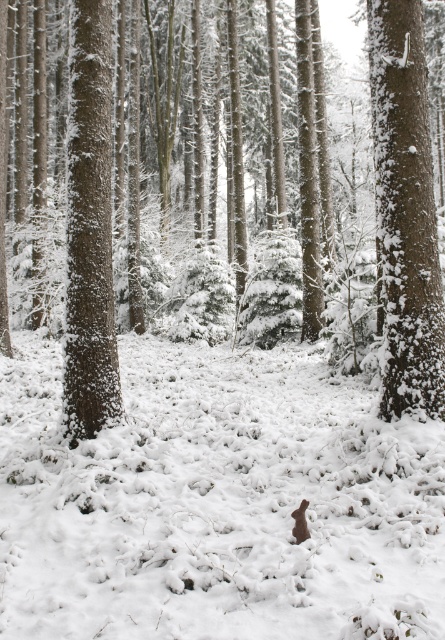
You are an observer in the winter forest scene. You notice the white fluffy snow at center and the brown furry rabbit at center. Which object is closer to you?

The white fluffy snow at center is closer to the viewer than the brown furry rabbit at center.